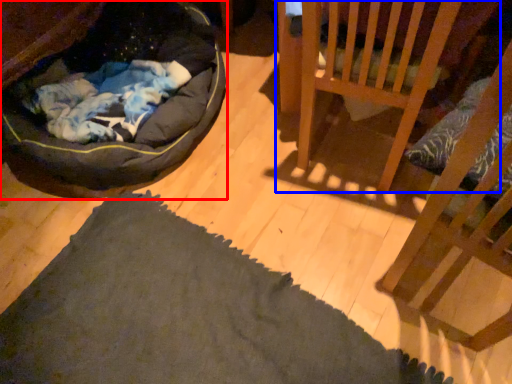
Question: Among these objects, which one is farthest to the camera, dog bed (highlighted by a red box) or furniture (highlighted by a blue box)?

Choices:
 (A) dog bed
 (B) furniture

Answer: (B)